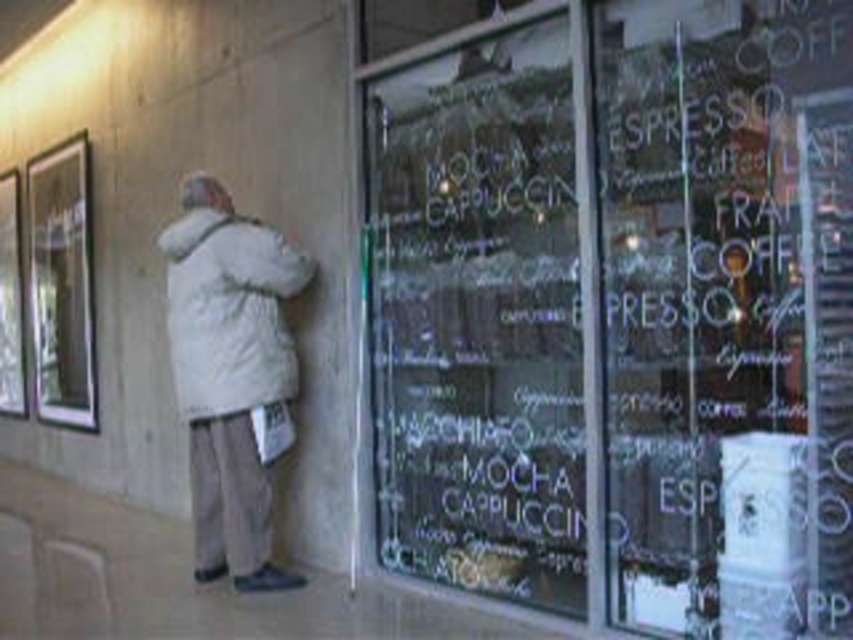
Can you confirm if white cotton coat at center is thinner than clear glass window at upper left?

Yes.

How far apart are white cotton coat at center and clear glass window at upper left?

They are 3.76 meters apart.

Is point (315, 266) positioned after point (80, 360)?

No, (315, 266) is in front of (80, 360).

Image resolution: width=853 pixels, height=640 pixels. Find the location of `white cotton coat at center`. white cotton coat at center is located at coordinates (229, 310).

Who is positioned more to the left, white chalkboard at center or white cotton coat at center?

Positioned to the left is white cotton coat at center.

Is white chalkboard at center closer to the viewer compared to white cotton coat at center?

Yes, white chalkboard at center is in front of white cotton coat at center.

Describe the element at coordinates (727, 314) in the screenshot. I see `white chalkboard at center` at that location.

Image resolution: width=853 pixels, height=640 pixels. Find the location of `white chalkboard at center`. white chalkboard at center is located at coordinates (727, 314).

Image resolution: width=853 pixels, height=640 pixels. What do you see at coordinates (727, 314) in the screenshot?
I see `white chalkboard at center` at bounding box center [727, 314].

Which is behind, point (769, 556) or point (57, 312)?

Positioned behind is point (57, 312).

What are the coordinates of `white chalkboard at center` in the screenshot? It's located at (727, 314).